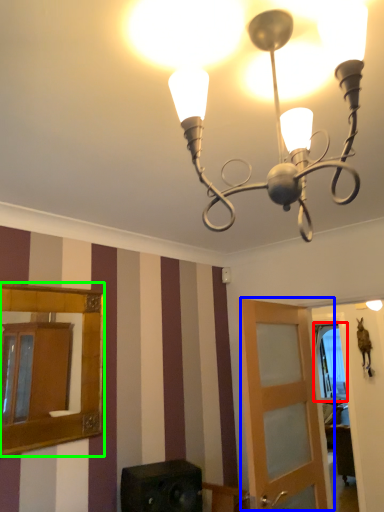
Question: Estimate the real-world distances between objects in this image. Which object is farther from window (highlighted by a red box), door (highlighted by a blue box) or mirror (highlighted by a green box)?

Choices:
 (A) door
 (B) mirror

Answer: (B)